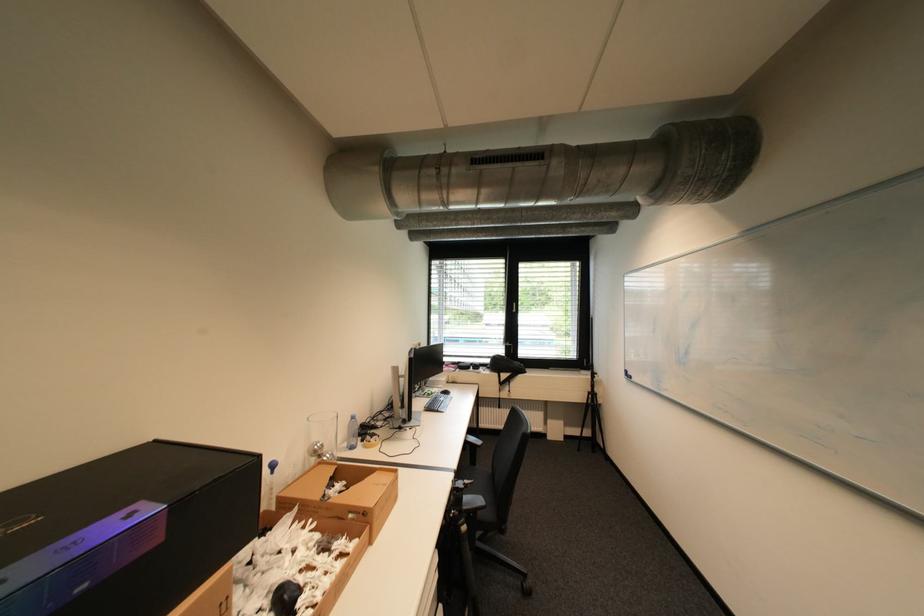
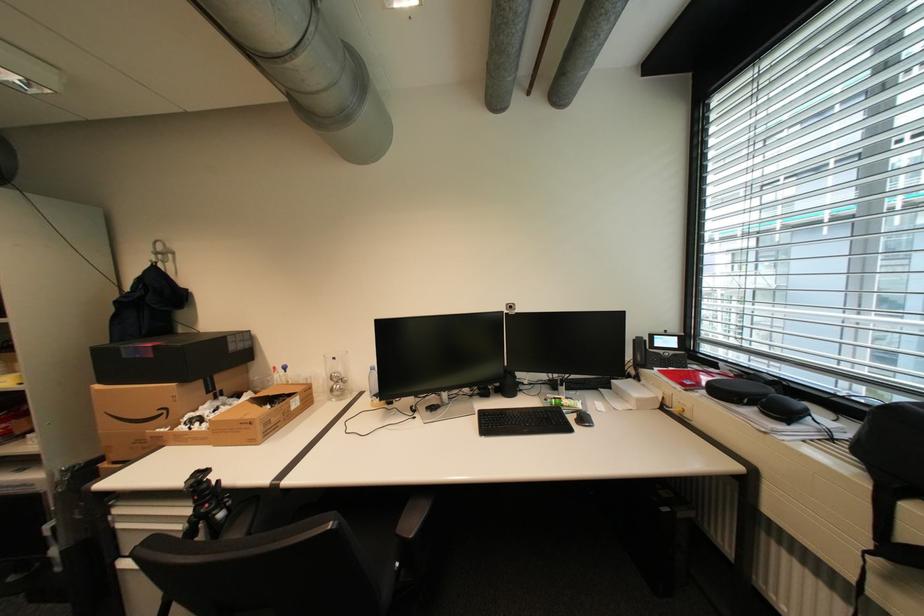
The point at (326, 447) is marked in the first image. Where is the corresponding point in the second image?

(343, 376)